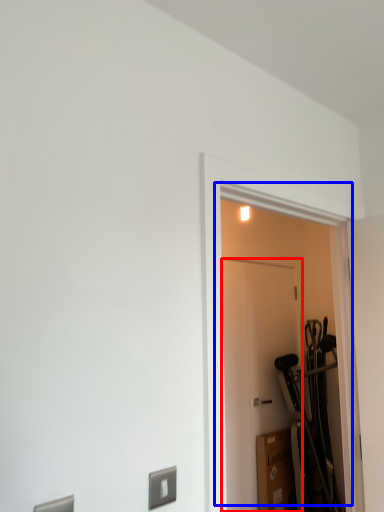
Question: Which object is closer to the camera taking this photo, door (highlighted by a red box) or door (highlighted by a blue box)?

Choices:
 (A) door
 (B) door

Answer: (B)